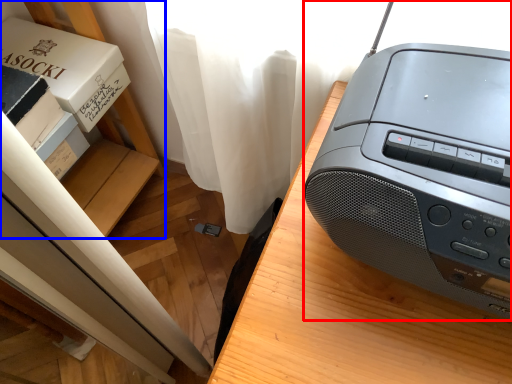
Question: Which object is further to the camera taking this photo, printer (highlighted by a red box) or shelf (highlighted by a blue box)?

Choices:
 (A) printer
 (B) shelf

Answer: (B)